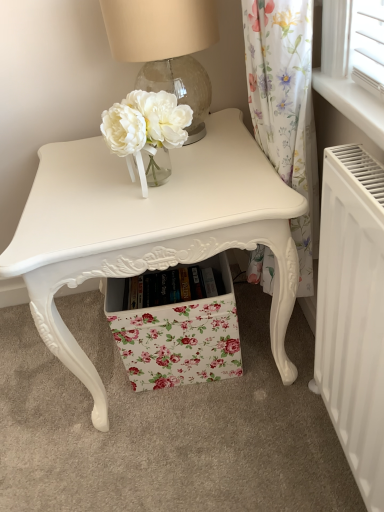
Locate an element on the screen. vacant space underneath translucent glass table lamp at upper center (from a real-world perspective) is located at coordinates (207, 128).